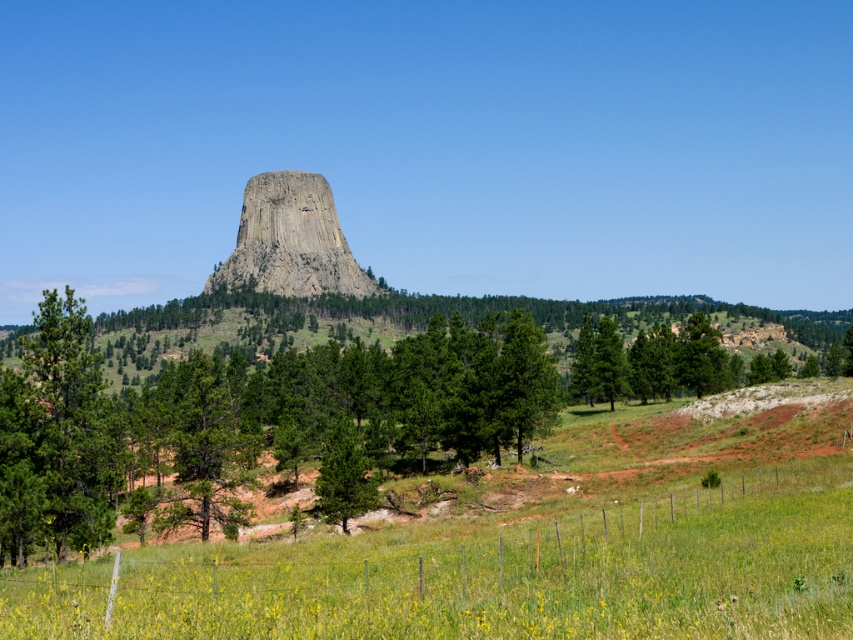
Question: Which point is closer to the camera?

Choices:
 (A) (328, 492)
 (B) (256, 188)

Answer: (A)

Question: Does granite rock formation at center appear over green rough bark tree at center?

Choices:
 (A) no
 (B) yes

Answer: (B)

Question: Is green matte tree at left below granite rock formation at center?

Choices:
 (A) yes
 (B) no

Answer: (A)

Question: Among these points, which one is farthest from the camera?

Choices:
 (A) (325, 497)
 (B) (56, 378)

Answer: (A)

Question: Based on their relative distances, which object is nearer to the green matte tree at left?

Choices:
 (A) granite rock formation at center
 (B) green rough bark tree at center

Answer: (B)

Question: Can you confirm if green matte tree at left is wider than granite rock formation at center?

Choices:
 (A) no
 (B) yes

Answer: (A)